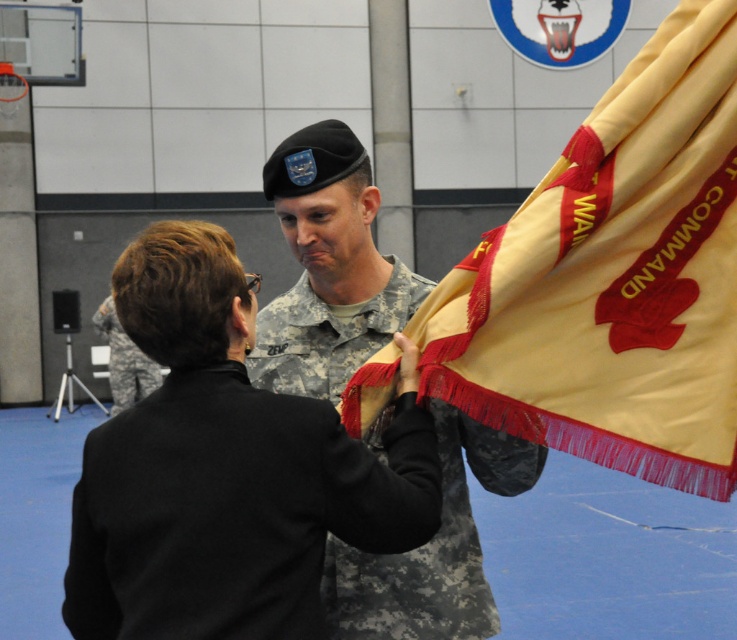
Is black fabric jacket at center above camouflage fabric uniform at left?

Actually, black fabric jacket at center is below camouflage fabric uniform at left.

Between point (310, 397) and point (105, 330), which one is positioned in front?

Point (310, 397) is more forward.

Identify the location of black fabric jacket at center. pos(226,470).

Can you confirm if yellow satin flag at right is positioned to the left of camouflage fabric uniform at center?

In fact, yellow satin flag at right is to the right of camouflage fabric uniform at center.

What do you see at coordinates (614, 278) in the screenshot? This screenshot has height=640, width=737. I see `yellow satin flag at right` at bounding box center [614, 278].

The width and height of the screenshot is (737, 640). Find the location of `yellow satin flag at right`. yellow satin flag at right is located at coordinates (614, 278).

Between point (604, 403) and point (139, 364), which one is positioned in front?

Positioned in front is point (604, 403).

Does yellow satin flag at right appear on the right side of camouflage fabric uniform at left?

Indeed, yellow satin flag at right is positioned on the right side of camouflage fabric uniform at left.

Is point (660, 348) farther from camera compared to point (150, 374)?

No, (660, 348) is closer to viewer.

Find the location of a particular element. The image size is (737, 640). yellow satin flag at right is located at coordinates (614, 278).